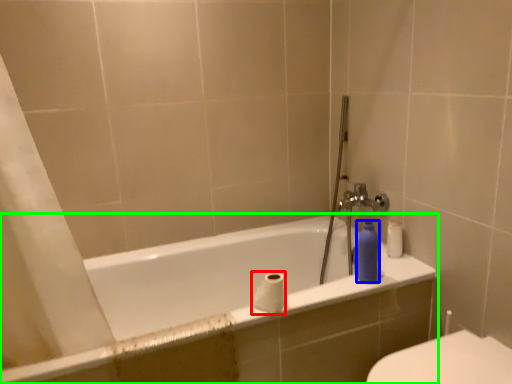
Question: Estimate the real-world distances between objects in this image. Which object is farther from toilet paper (highlighted by a red box), toiletry (highlighted by a blue box) or bathtub (highlighted by a green box)?

Choices:
 (A) toiletry
 (B) bathtub

Answer: (B)